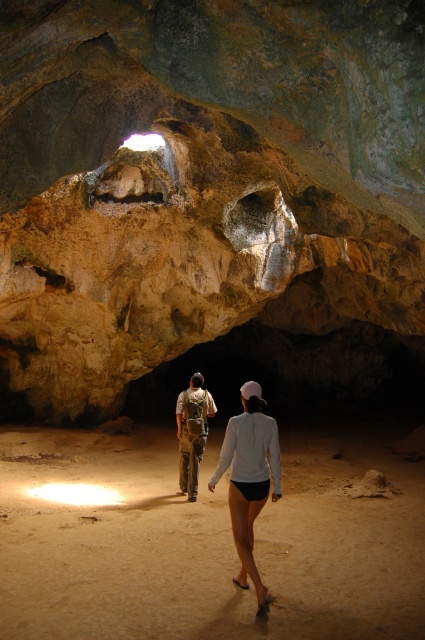
Question: Is white matte shorts at center thinner than camouflage fabric backpack at center?

Choices:
 (A) yes
 (B) no

Answer: (B)

Question: Which object appears farthest from the camera in this image?

Choices:
 (A) rustic stone cave at center
 (B) white matte shorts at center
 (C) camouflage fabric backpack at center

Answer: (C)

Question: Considering the relative positions of rustic stone cave at center and camouflage fabric backpack at center in the image provided, where is rustic stone cave at center located with respect to camouflage fabric backpack at center?

Choices:
 (A) below
 (B) above

Answer: (B)

Question: Observing the image, what is the correct spatial positioning of white matte shorts at center in reference to camouflage fabric backpack at center?

Choices:
 (A) below
 (B) above

Answer: (B)

Question: Considering the real-world distances, which object is closest to the white matte shorts at center?

Choices:
 (A) camouflage fabric backpack at center
 (B) rustic stone cave at center

Answer: (A)

Question: Which point appears closest to the camera in this image?

Choices:
 (A) 6,243
 (B) 260,483

Answer: (B)